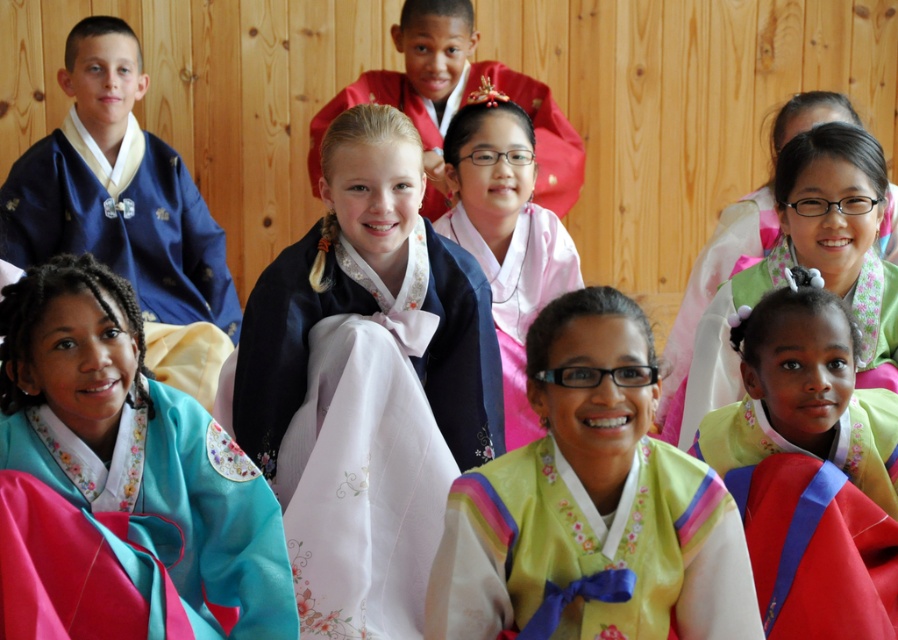
You are a photographer standing in front of the wooden wall. You want to take a photo of the teal satin blouse at lower left and the pink satin blouse at center. Which blouse will appear larger in the photo?

The teal satin blouse at lower left will appear larger in the photo because it is closer to the viewer than the pink satin blouse at center.

You are a photographer standing in front of the wooden wall. You want to take a photo of both the satin blue dress at center and the matte pink kimono at center. Which one should you adjust your position to focus on first to ensure both are in frame?

The matte pink kimono at center is behind the satin blue dress at center, so you should focus on the satin blue dress at center first to ensure both are visible in the photo.

You are a tailor observing the teal satin blouse at lower left and the pink satin blouse at center. Which blouse would require less fabric in the vertical direction when making a similar design?

The teal satin blouse at lower left requires less fabric in the vertical direction because it has a lesser height compared to the pink satin blouse at center.